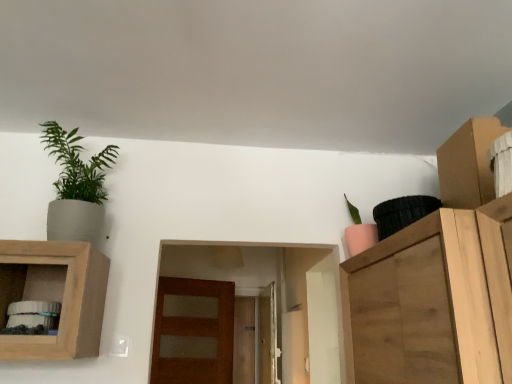
What do you see at coordinates (359, 232) in the screenshot? This screenshot has height=384, width=512. I see `pink matte pot at upper right, positioned as the second houseplant in left-to-right order` at bounding box center [359, 232].

Locate an element on the screen. The image size is (512, 384). wooden cabinet at left is located at coordinates tap(54, 296).

Locate an element on the screen. The height and width of the screenshot is (384, 512). matte gray pot at upper left, arranged as the 1th houseplant when viewed from the left is located at coordinates (76, 187).

Image resolution: width=512 pixels, height=384 pixels. What do you see at coordinates (468, 164) in the screenshot?
I see `brown cardboard cabinet at upper right` at bounding box center [468, 164].

What is the approximate width of brown matte door at center?

brown matte door at center is 11.52 centimeters in width.

Find the location of `pink matte pot at upper right, the first houseplant in the right-to-left sequence`. pink matte pot at upper right, the first houseplant in the right-to-left sequence is located at coordinates tap(359, 232).

Is point (76, 299) closer to viewer compared to point (162, 360)?

Yes, it is in front of point (162, 360).

Which is in front, wooden cabinet at left or brown matte door at center?

wooden cabinet at left is more forward.

From the image's perspective, relative to brown matte door at center, is wooden cabinet at left above or below?

Clearly, from the image's perspective, wooden cabinet at left is above brown matte door at center.

Between matte gray pot at upper left, which appears as the 2th houseplant when viewed from the right, and wooden cabinet at left, which one has smaller size?

matte gray pot at upper left, which appears as the 2th houseplant when viewed from the right, is smaller.

Relative to wooden cabinet at left, is matte gray pot at upper left, which appears as the 2th houseplant when viewed from the right, in front or behind?

matte gray pot at upper left, which appears as the 2th houseplant when viewed from the right, is behind wooden cabinet at left.

Considering the sizes of objects matte gray pot at upper left, which appears as the 2th houseplant when viewed from the right, and wooden cabinet at left in the image provided, who is thinner, matte gray pot at upper left, which appears as the 2th houseplant when viewed from the right, or wooden cabinet at left?

With smaller width is matte gray pot at upper left, which appears as the 2th houseplant when viewed from the right.

Is wooden cabinet at left inside or outside of matte gray pot at upper left, which appears as the 2th houseplant when viewed from the right?

wooden cabinet at left is not inside matte gray pot at upper left, which appears as the 2th houseplant when viewed from the right, it's outside.

From a real-world perspective, is wooden cabinet at left above or below matte gray pot at upper left, arranged as the 1th houseplant when viewed from the left?

wooden cabinet at left is below matte gray pot at upper left, arranged as the 1th houseplant when viewed from the left.

Which is behind, point (49, 288) or point (55, 146)?

The point (55, 146) is more distant.

Is wooden cabinet at left with matte gray pot at upper left, which appears as the 2th houseplant when viewed from the right?

No, wooden cabinet at left is not beside matte gray pot at upper left, which appears as the 2th houseplant when viewed from the right.

Consider the image. Considering their positions, is brown cardboard cabinet at upper right located in front of or behind brown matte door at center?

In the image, brown cardboard cabinet at upper right appears in front of brown matte door at center.

Is brown cardboard cabinet at upper right to the left or to the right of brown matte door at center in the image?

A: brown cardboard cabinet at upper right is positioned on brown matte door at center's right side.

Is brown cardboard cabinet at upper right facing towards brown matte door at center?

No.

Considering the sizes of objects brown cardboard cabinet at upper right and brown matte door at center in the image provided, who is bigger, brown cardboard cabinet at upper right or brown matte door at center?

brown matte door at center.

Is brown matte door at center beside brown cardboard cabinet at upper right?

brown matte door at center and brown cardboard cabinet at upper right are not in contact.

Is point (220, 292) positioned behind point (485, 164)?

Yes, it is.

Which object is more forward, brown matte door at center or brown cardboard cabinet at upper right?

brown cardboard cabinet at upper right is more forward.

Is brown matte door at center wider or thinner than brown cardboard cabinet at upper right?

In the image, brown matte door at center appears to be more narrow than brown cardboard cabinet at upper right.

The image size is (512, 384). Identify the location of cabinetry behind the brown cardboard cabinet at upper right. (54, 296).

Based on the photo, which of these two, brown cardboard cabinet at upper right or wooden cabinet at left, stands shorter?

Standing shorter between the two is brown cardboard cabinet at upper right.

Would you say brown cardboard cabinet at upper right is outside wooden cabinet at left?

Absolutely, brown cardboard cabinet at upper right is external to wooden cabinet at left.

Could you tell me if brown cardboard cabinet at upper right is turned towards wooden cabinet at left?

Yes, brown cardboard cabinet at upper right is turned towards wooden cabinet at left.

Is the surface of brown cardboard cabinet at upper right in direct contact with pink matte pot at upper right, the first houseplant in the right-to-left sequence?

No, brown cardboard cabinet at upper right is not making contact with pink matte pot at upper right, the first houseplant in the right-to-left sequence.

Which object is thinner, brown cardboard cabinet at upper right or pink matte pot at upper right, positioned as the second houseplant in left-to-right order?

pink matte pot at upper right, positioned as the second houseplant in left-to-right order, is thinner.

Which object is closer to the camera, brown cardboard cabinet at upper right or pink matte pot at upper right, the first houseplant in the right-to-left sequence?

Positioned in front is brown cardboard cabinet at upper right.

The height and width of the screenshot is (384, 512). Identify the location of cabinet directly beneath the pink matte pot at upper right, positioned as the second houseplant in left-to-right order (from a real-world perspective). (468, 164).

The height and width of the screenshot is (384, 512). Identify the location of door that is under the wooden cabinet at left (from a real-world perspective). (195, 334).

From the image's perspective, count 2nd houseplants upward from the wooden cabinet at left and point to it. Please provide its 2D coordinates.

[(76, 187)]

Which object lies nearer to the anchor point brown cardboard cabinet at upper right, brown matte door at center or pink matte pot at upper right, positioned as the second houseplant in left-to-right order?

Based on the image, pink matte pot at upper right, positioned as the second houseplant in left-to-right order, appears to be nearer to brown cardboard cabinet at upper right.

From the image, which object appears to be nearer to brown matte door at center, brown cardboard cabinet at upper right or pink matte pot at upper right, positioned as the second houseplant in left-to-right order?

pink matte pot at upper right, positioned as the second houseplant in left-to-right order.

Estimate the real-world distances between objects in this image. Which object is further from pink matte pot at upper right, the first houseplant in the right-to-left sequence, brown matte door at center or matte gray pot at upper left, which appears as the 2th houseplant when viewed from the right?

The object further to pink matte pot at upper right, the first houseplant in the right-to-left sequence, is brown matte door at center.

Estimate the real-world distances between objects in this image. Which object is further from brown matte door at center, pink matte pot at upper right, the first houseplant in the right-to-left sequence, or matte gray pot at upper left, which appears as the 2th houseplant when viewed from the right?

The object further to brown matte door at center is pink matte pot at upper right, the first houseplant in the right-to-left sequence.

Estimate the real-world distances between objects in this image. Which object is closer to matte gray pot at upper left, arranged as the 1th houseplant when viewed from the left, brown matte door at center or pink matte pot at upper right, positioned as the second houseplant in left-to-right order?

pink matte pot at upper right, positioned as the second houseplant in left-to-right order, lies closer to matte gray pot at upper left, arranged as the 1th houseplant when viewed from the left, than the other object.

Which object lies nearer to the anchor point brown matte door at center, wooden cabinet at left or matte gray pot at upper left, which appears as the 2th houseplant when viewed from the right?

wooden cabinet at left.

Estimate the real-world distances between objects in this image. Which object is further from wooden cabinet at left, matte gray pot at upper left, which appears as the 2th houseplant when viewed from the right, or brown cardboard cabinet at upper right?

brown cardboard cabinet at upper right is positioned further to the anchor wooden cabinet at left.

Consider the image. Based on their spatial positions, is matte gray pot at upper left, which appears as the 2th houseplant when viewed from the right, or wooden cabinet at left further from brown matte door at center?

The object further to brown matte door at center is matte gray pot at upper left, which appears as the 2th houseplant when viewed from the right.

Where is `houseplant located between matte gray pot at upper left, arranged as the 1th houseplant when viewed from the left, and brown cardboard cabinet at upper right in the left-right direction`? This screenshot has width=512, height=384. houseplant located between matte gray pot at upper left, arranged as the 1th houseplant when viewed from the left, and brown cardboard cabinet at upper right in the left-right direction is located at coordinates (359, 232).

This screenshot has height=384, width=512. I want to click on houseplant between wooden cabinet at left and pink matte pot at upper right, positioned as the second houseplant in left-to-right order, so click(x=76, y=187).

I want to click on houseplant between matte gray pot at upper left, arranged as the 1th houseplant when viewed from the left, and brown matte door at center in the front-back direction, so click(359, 232).

Image resolution: width=512 pixels, height=384 pixels. I want to click on cabinetry between brown cardboard cabinet at upper right and brown matte door at center in the front-back direction, so click(54, 296).